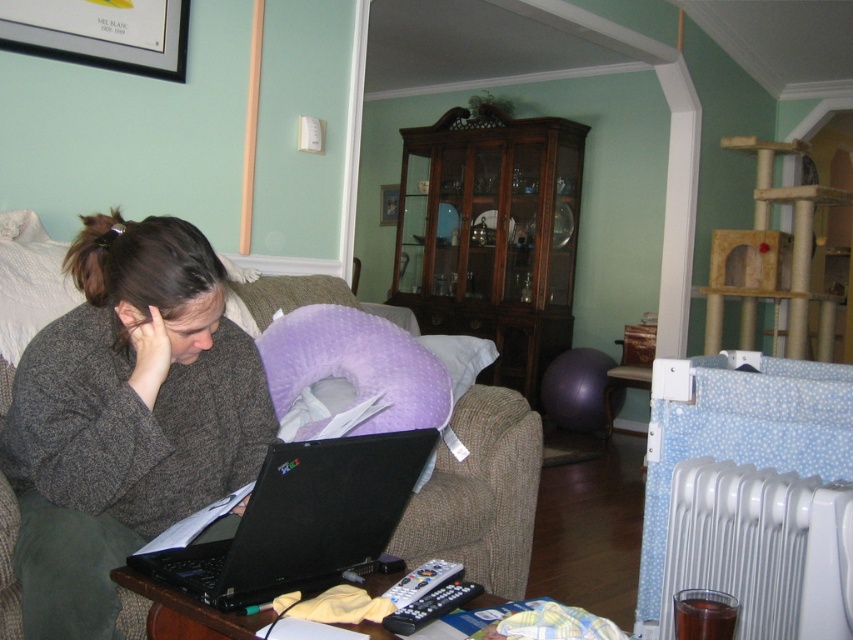
Who is positioned more to the left, black matte laptop at lower center or white plastic radiator at lower right?

black matte laptop at lower center

Which is above, black matte laptop at lower center or white plastic radiator at lower right?

Positioned higher is black matte laptop at lower center.

Between point (219, 588) and point (844, 488), which one is positioned behind?

Point (844, 488)

Where is `black matte laptop at lower center`? black matte laptop at lower center is located at coordinates (300, 522).

Who is taller, brown fabric couch at center or black matte laptop at lower center?

With more height is brown fabric couch at center.

Who is positioned more to the left, brown fabric couch at center or black matte laptop at lower center?

black matte laptop at lower center is more to the left.

Does point (506, 580) come in front of point (358, 464)?

No, it is behind (358, 464).

Find the location of a particular element. The height and width of the screenshot is (640, 853). brown fabric couch at center is located at coordinates (479, 481).

Describe the element at coordinates (126, 417) in the screenshot. I see `dark gray sweater at center` at that location.

Who is shorter, dark gray sweater at center or black matte laptop at lower center?

Standing shorter between the two is black matte laptop at lower center.

Which is in front, point (161, 417) or point (177, 577)?

Positioned in front is point (177, 577).

Where is `dark gray sweater at center`? dark gray sweater at center is located at coordinates 126,417.